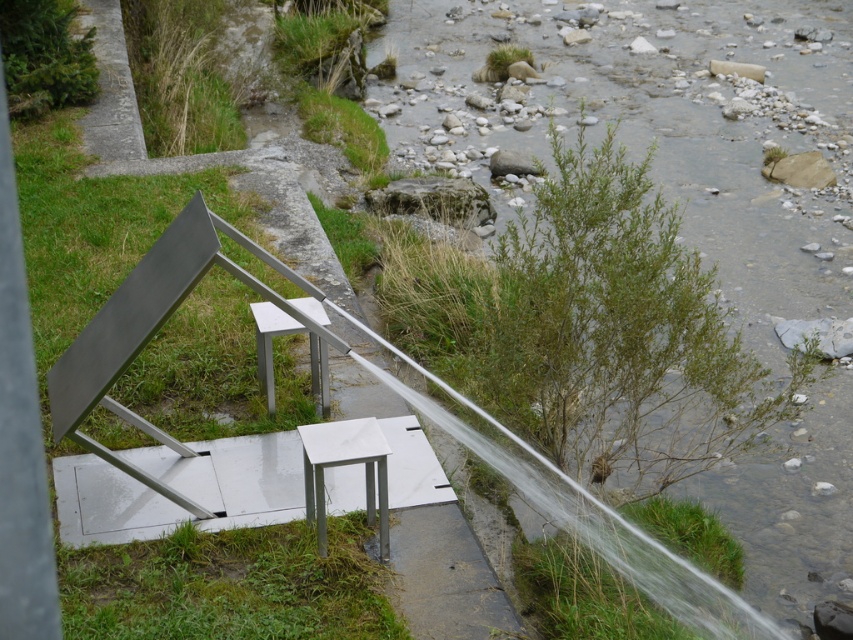
In the scene shown: You are planning to place a small potted plant between the white marble stool at center and the metallic silver stool at center. Which stool should the plant be closer to if you want it to be near the smaller one?

The white marble stool at center is smaller than the metallic silver stool at center, so the plant should be placed closer to the white marble stool at center.

You are a visitor standing at the edge of the stream and want to sit down. There are two stools available in the scene. Which stool is closer to the stream? The white marble stool at center or the metallic silver stool at center?

Both the white marble stool at center and the metallic silver stool at center are located at the same central position, so they are equally distant from the stream.